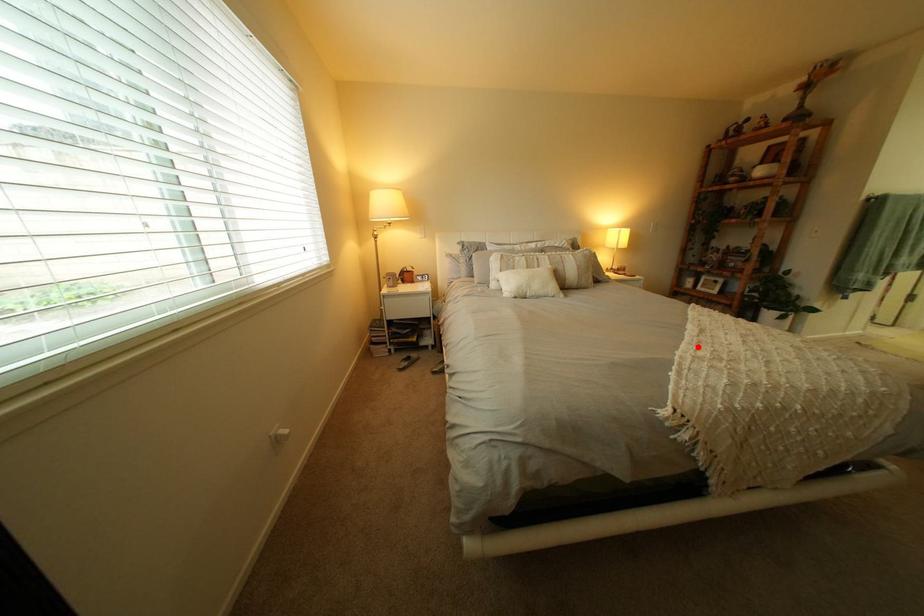
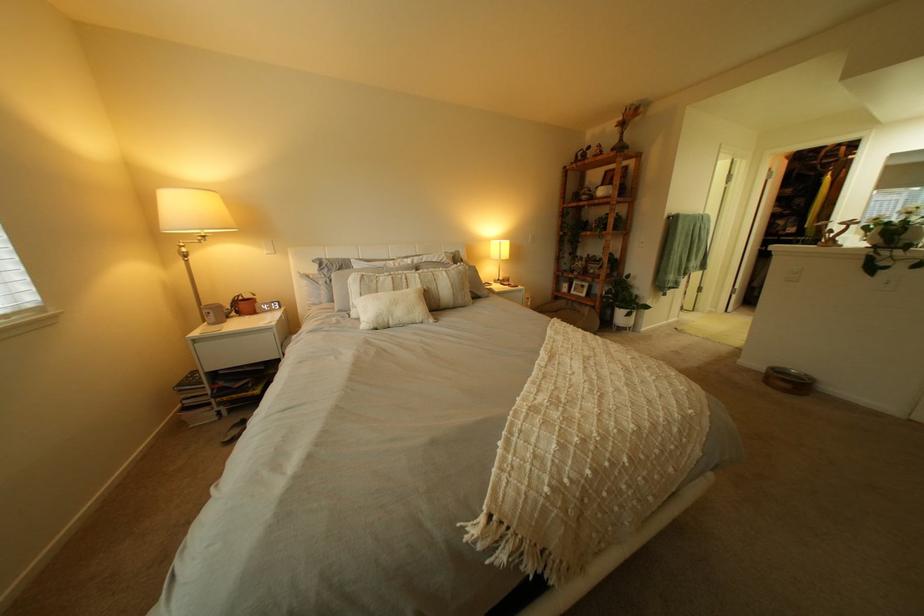
Find the pixel in the second image that matches the highlighted location in the first image.

(541, 387)